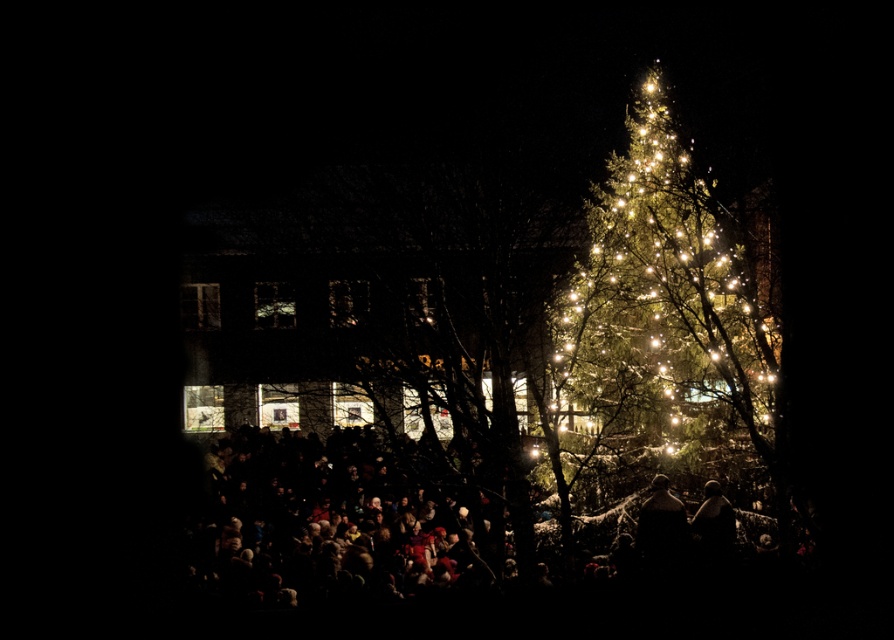
Can you confirm if snow-covered crowd at lower center is positioned below illuminated green pine at right?

Yes, snow-covered crowd at lower center is below illuminated green pine at right.

Is snow-covered crowd at lower center positioned behind illuminated green pine at right?

No.

The image size is (894, 640). In order to click on snow-covered crowd at lower center in this screenshot , I will do pyautogui.click(x=450, y=557).

Which is above, snow-covered crowd at lower center or brown leather jacket at lower right?

Positioned higher is brown leather jacket at lower right.

Is point (739, 579) farther from camera compared to point (704, 524)?

That is False.

Locate an element on the screen. This screenshot has height=640, width=894. snow-covered crowd at lower center is located at coordinates (450, 557).

Who is more distant from viewer, (689, 424) or (720, 529)?

The point (689, 424) is more distant.

Between illuminated green pine at right and brown leather jacket at lower right, which one appears on the right side from the viewer's perspective?

Positioned to the right is brown leather jacket at lower right.

The width and height of the screenshot is (894, 640). What do you see at coordinates (670, 300) in the screenshot? I see `illuminated green pine at right` at bounding box center [670, 300].

The height and width of the screenshot is (640, 894). I want to click on illuminated green pine at right, so click(x=670, y=300).